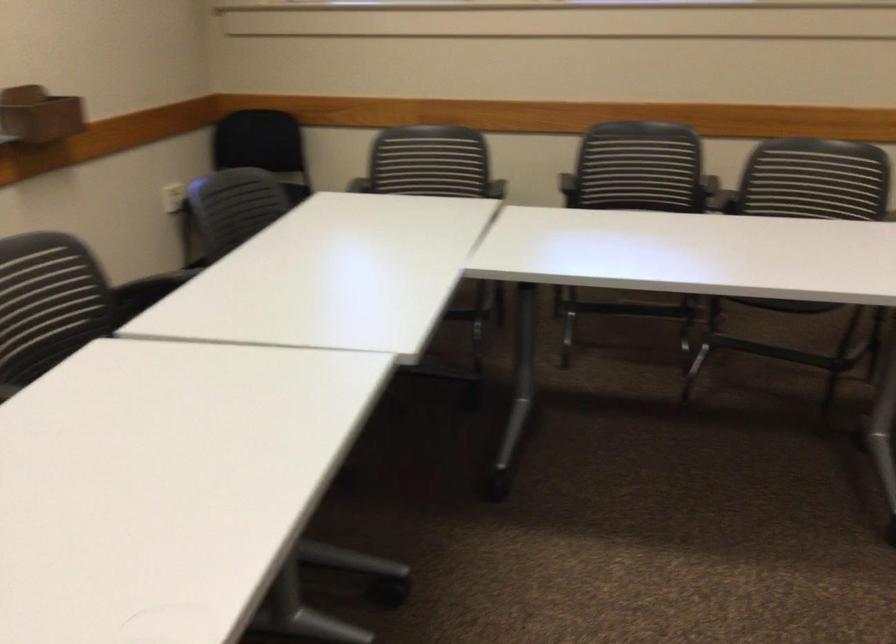
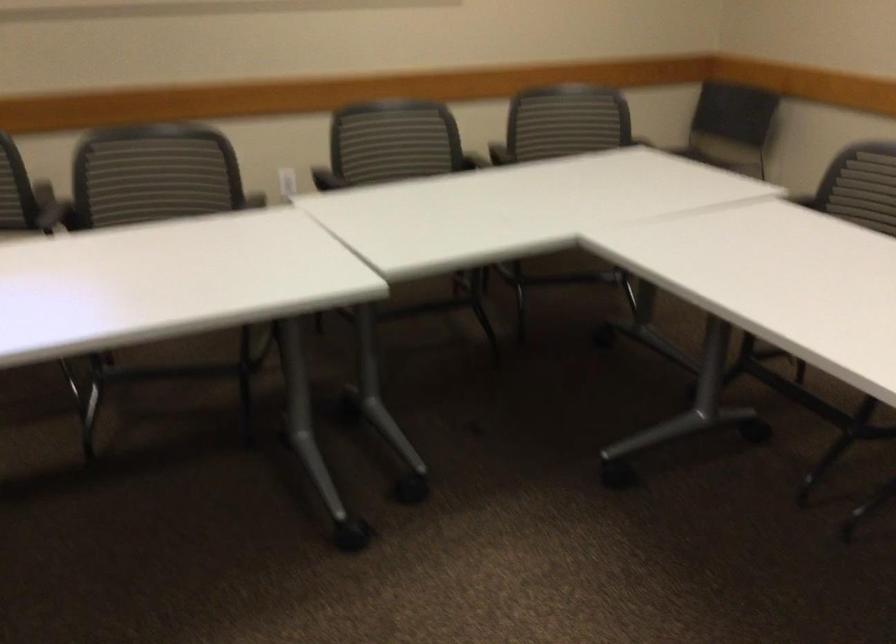
The point at (807,176) is marked in the first image. Where is the corresponding point in the second image?

(154, 176)